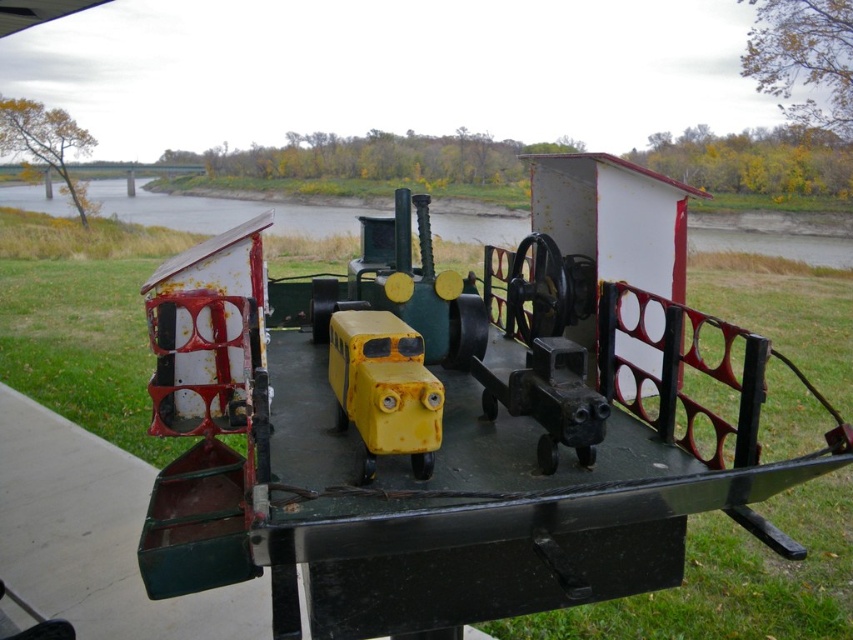
You are setting up a display for a toy store and have a shelf that can only accommodate items up to 12 inches in width. You have two items to place there, the rusty metal train at center and the yellow matte toy bus at center. Based on their widths, can both items fit on the shelf together?

The rusty metal train at center might be wider than the yellow matte toy bus at center. Since the shelf can only hold up to 12 inches, it is uncertain if both will fit together without exceeding the width limit.

You are a child playing with the rusty metal train at center and the yellow matte toy bus at center. You want to know which toy is higher up. Which one is positioned higher?

The rusty metal train at center is located above the yellow matte toy bus at center, so the rusty metal train at center is positioned higher.

You are standing at the position of point (345, 378) and want to walk towards the ferry. Is point (756, 444) behind you or in front of you relative to your direction of movement?

Point (756, 444) is behind point (345, 378), so if you are facing the ferry and standing at point (345, 378), point (756, 444) would be behind you.